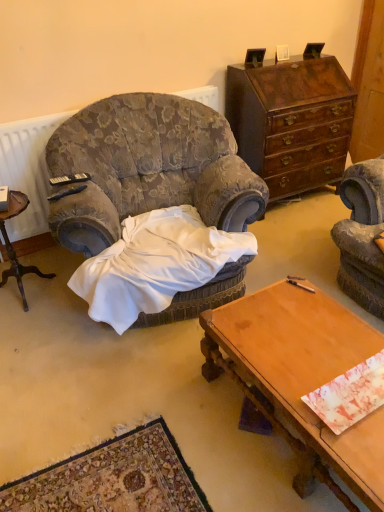
Where is `vacant area that lies in front of white satin blanket at center`? vacant area that lies in front of white satin blanket at center is located at coordinates (131, 414).